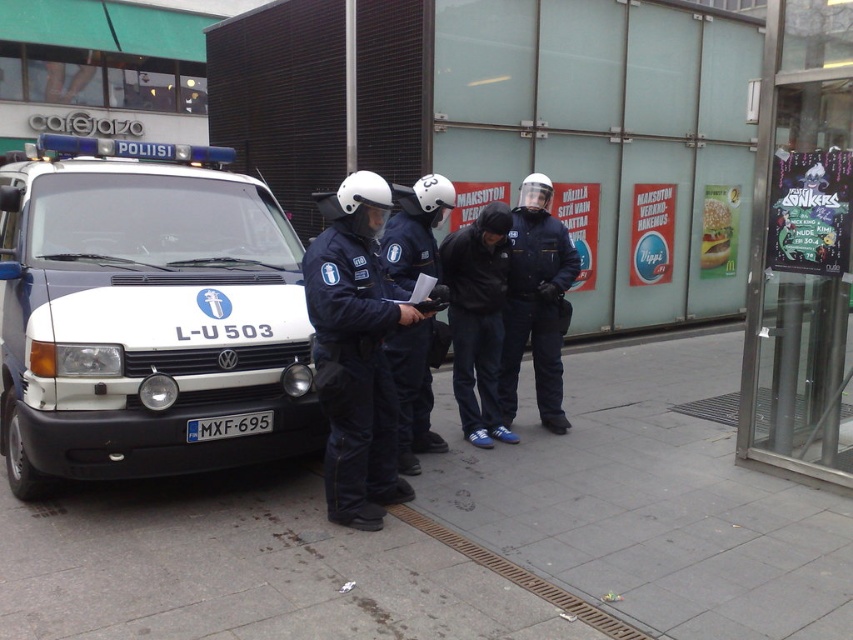
Question: Based on their relative distances, which object is farther from the gray concrete pavement at lower center?

Choices:
 (A) black matte jacket at center
 (B) blue metallic license plate at front

Answer: (A)

Question: Which object appears closest to the camera in this image?

Choices:
 (A) matte black uniform at center
 (B) blue metallic license plate at front
 (C) matte black helmet at center

Answer: (B)

Question: Is matte black uniform at center closer to the viewer compared to matte black helmet at center?

Choices:
 (A) no
 (B) yes

Answer: (A)

Question: Can you confirm if navy blue uniform at center is positioned to the right of black matte jacket at center?

Choices:
 (A) no
 (B) yes

Answer: (A)

Question: Can you confirm if black matte jacket at center is positioned to the left of matte black helmet at center?

Choices:
 (A) no
 (B) yes

Answer: (A)

Question: Which is farther from the white matte van at left?

Choices:
 (A) gray concrete pavement at lower center
 (B) black matte jacket at center
 (C) blue metallic license plate at front

Answer: (A)